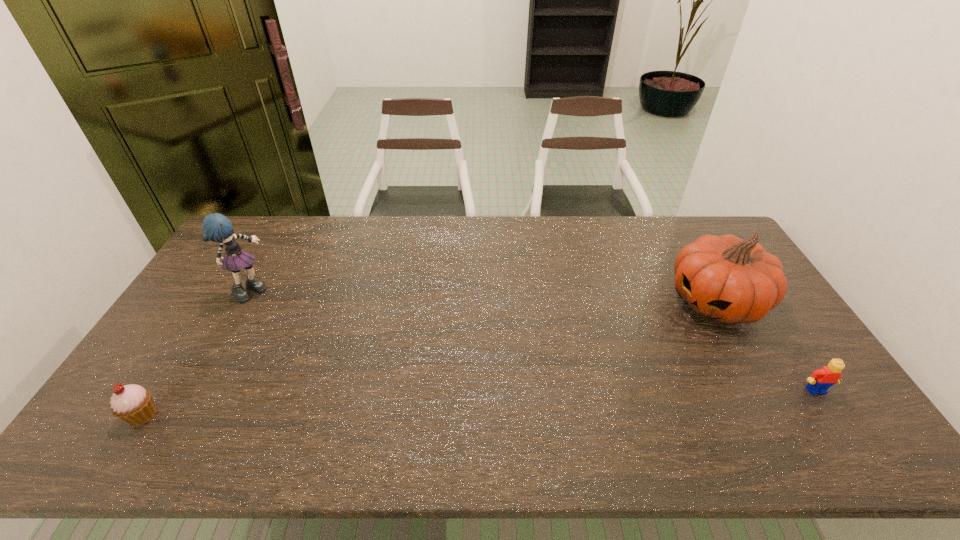
You are a GUI agent. You are given a task and a screenshot of the screen. Output one action in this format:
    pyautogui.click(x=<x>, y=<y>)
    Task: Click on the vacant space located 0.250m on the front-facing side of the third object from right to left
    
    Given the screenshot: What is the action you would take?
    pyautogui.click(x=324, y=325)

Identify the location of vacant space located 0.360m on the front-facing side of the third object from right to left. (353, 339).

Locate an element on the screen. Image resolution: width=960 pixels, height=540 pixels. free space located on the front-facing side of the third object from right to left is located at coordinates (322, 323).

Locate an element on the screen. Image resolution: width=960 pixels, height=540 pixels. cupcake present at the near edge is located at coordinates (132, 403).

The image size is (960, 540). What are the coordinates of `Lego that is at the near edge` in the screenshot? It's located at (819, 382).

At what (x,y) coordinates should I click in order to perform the action: click on cupcake that is at the left edge. Please return your answer as a coordinate pair (x, y). Looking at the image, I should click on (132, 403).

At what (x,y) coordinates should I click in order to perform the action: click on rag doll that is positioned at the left edge. Please return your answer as a coordinate pair (x, y). Image resolution: width=960 pixels, height=540 pixels. Looking at the image, I should click on (216, 227).

At what (x,y) coordinates should I click in order to perform the action: click on Lego that is positioned at the right edge. Please return your answer as a coordinate pair (x, y). Looking at the image, I should click on (819, 382).

Identify the location of pumpkin located at the right edge. The height and width of the screenshot is (540, 960). (730, 280).

Find the location of a particular element. This screenshot has width=960, height=540. object located at the near left corner is located at coordinates (132, 403).